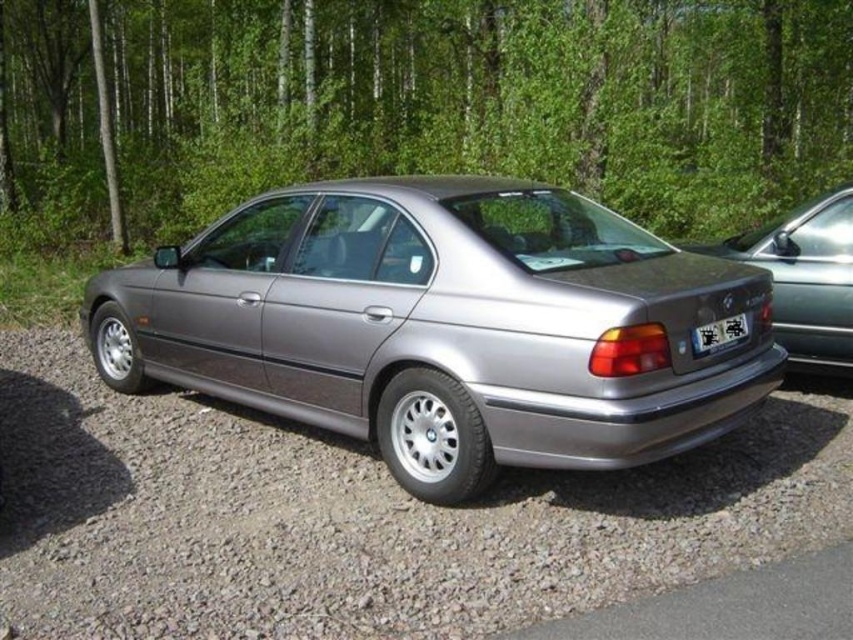
You are standing at the point closest to the car in the image. Which of the two points, point (672, 298) or point (787, 595), is farther away from you?

Point (672, 298) is behind point (787, 595), so it is farther away from you.

You are a delivery person trying to park your van, which is 5 meters long, in the gray gravel parking lot at lower left. The satin metallic car at center is currently occupying part of the parking space. Can you fit your van into the remaining space?

The satin metallic car at center is bigger than gray gravel parking lot at lower left. Since the car is larger than the parking area, it might be blocking most of the space, making it unlikely that a 5 meter van would fit in the remaining area.